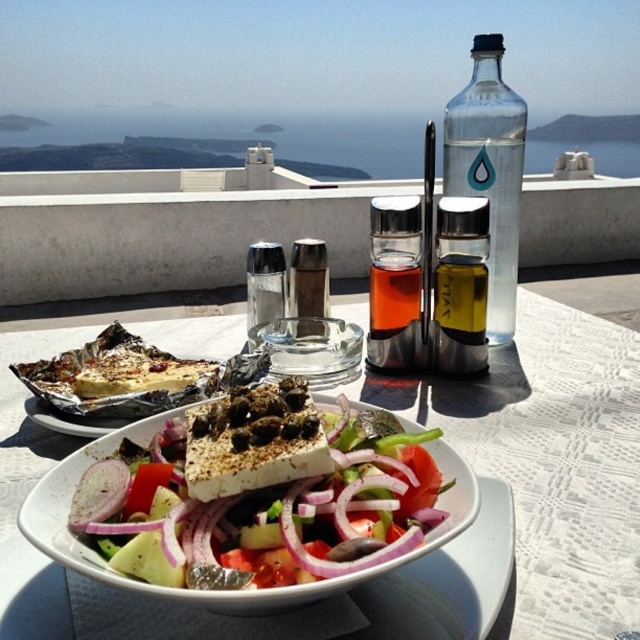
Is point (500, 125) less distant than point (253, 346)?

Yes, it is in front of point (253, 346).

Which of these two, transparent glass bottle at upper right or clear glass salt shaker at center, stands shorter?

With less height is clear glass salt shaker at center.

Is point (460, 122) more distant than point (273, 250)?

No, it is not.

This screenshot has height=640, width=640. Find the location of `transparent glass bottle at upper right`. transparent glass bottle at upper right is located at coordinates (490, 170).

Does white ceramic bowl at center come in front of purple translucent onion at center?

Yes, it is in front of purple translucent onion at center.

Image resolution: width=640 pixels, height=640 pixels. I want to click on white ceramic bowl at center, so click(572, 468).

You are a GUI agent. You are given a task and a screenshot of the screen. Output one action in this format:
    pyautogui.click(x=<x>, y=<y>)
    Task: Click on the white ceramic bowl at center
    The width and height of the screenshot is (640, 640).
    Given the screenshot: What is the action you would take?
    pyautogui.click(x=572, y=468)

Does translucent glass oil at center have a lesser height compared to purple translucent onion at center?

In fact, translucent glass oil at center may be taller than purple translucent onion at center.

Is point (465, 330) positioned behind point (113, 502)?

Yes.

Measure the distance between translucent glass oil at center and camera.

The distance of translucent glass oil at center from camera is 16.38 inches.

Locate an element on the screen. This screenshot has height=640, width=640. translucent glass oil at center is located at coordinates (460, 285).